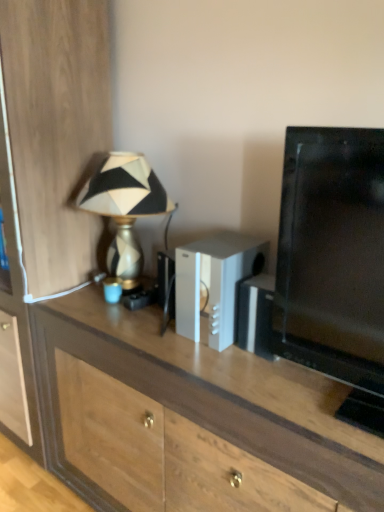
You are a GUI agent. You are given a task and a screenshot of the screen. Output one action in this format:
    pyautogui.click(x=<x>, y=<y>)
    Task: Click on the free location in front of gold textured lamp at left
    
    Given the screenshot: What is the action you would take?
    pyautogui.click(x=120, y=323)